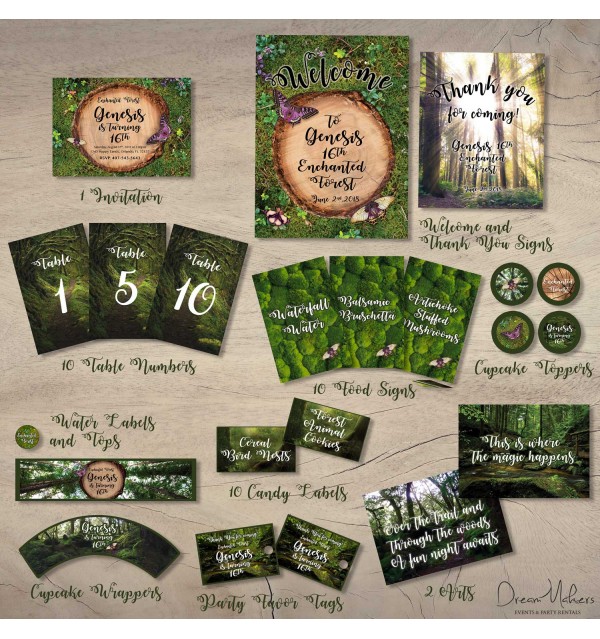
At what (x,y) coordinates should I click in order to perform the action: click on 10 table numbers. Please return your answer as a coordinate pair (x, y). The image size is (600, 639). Looking at the image, I should click on (133, 372).